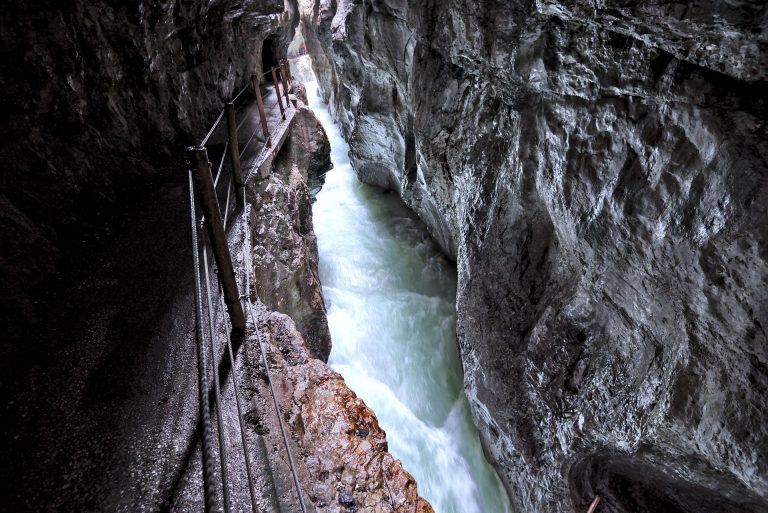
Locate an element on the screen. The height and width of the screenshot is (513, 768). walk way is located at coordinates (133, 402).